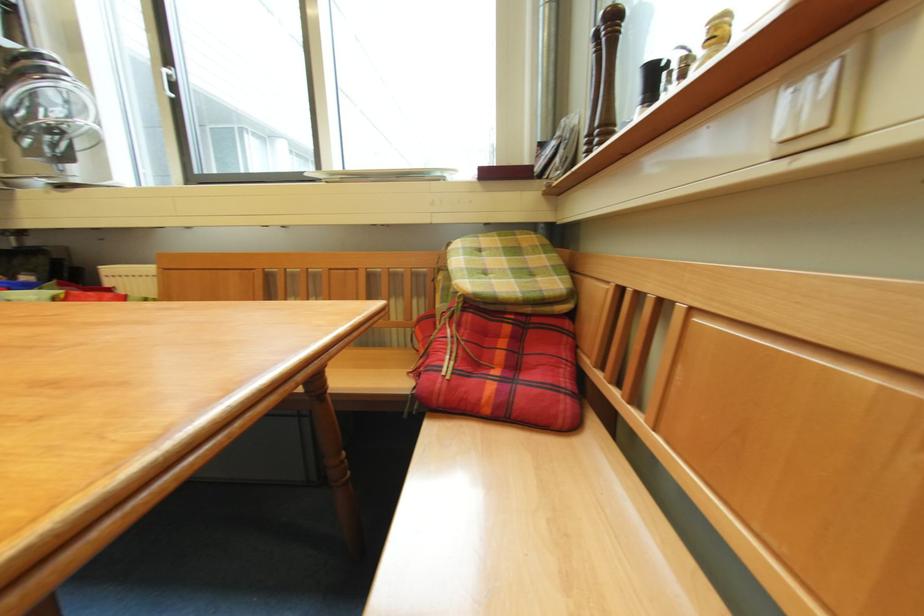
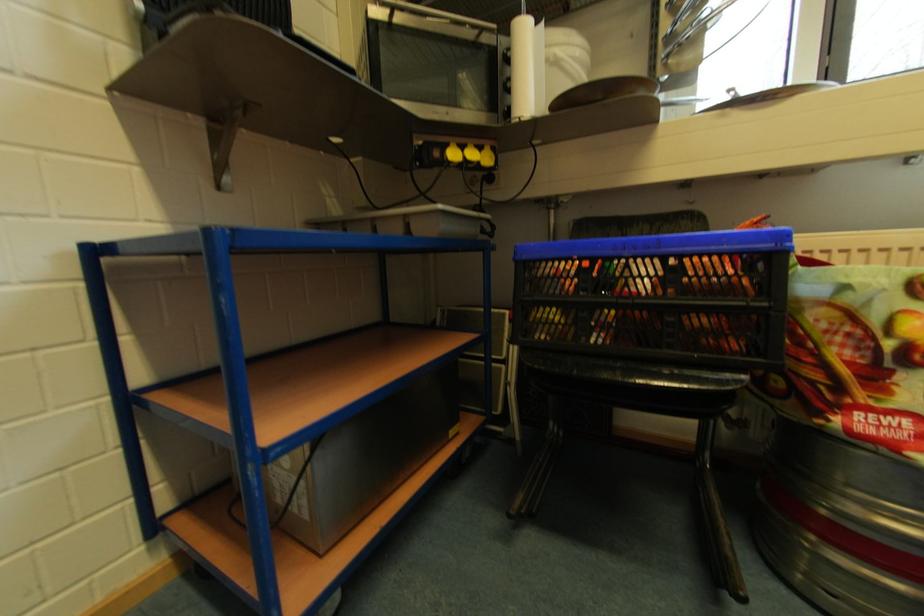
Question: Which direction would the cameraman need to move to produce the second image? Reply with the corresponding letter.

Choices:
 (A) Left
 (B) Right
 (C) Forward
 (D) Backward

Answer: (A)